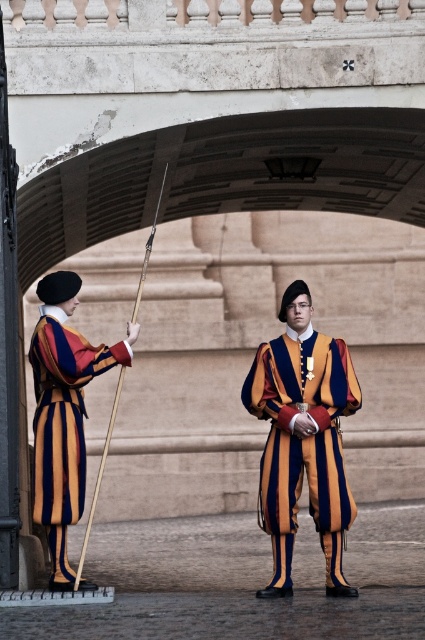
Who is taller, velvet striped uniform at center or matte striped uniform at left?

velvet striped uniform at center is taller.

Which of these two, velvet striped uniform at center or matte striped uniform at left, stands shorter?

With less height is matte striped uniform at left.

Measure the distance between point (331, 568) and camera.

89.41 feet

You are a GUI agent. You are given a task and a screenshot of the screen. Output one action in this format:
    pyautogui.click(x=<x>, y=<y>)
    Task: Click on the velvet striped uniform at center
    The image size is (425, 640).
    Given the screenshot: What is the action you would take?
    pyautogui.click(x=303, y=438)